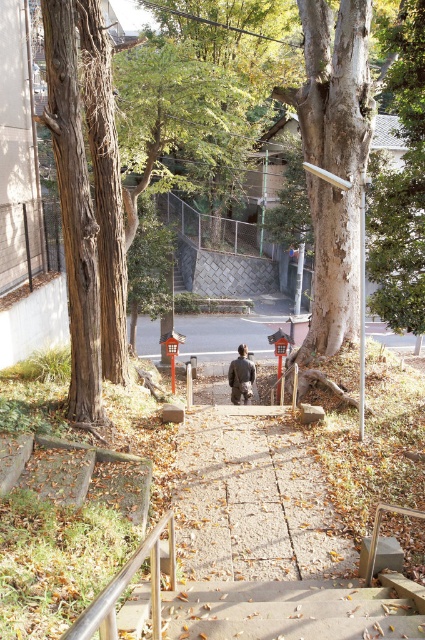
Question: Based on their relative distances, which object is farther from the camouflage jacket at center?

Choices:
 (A) concrete stairs at center
 (B) metallic silver railing at lower left

Answer: (B)

Question: Is metallic silver railing at lower left in front of camouflage jacket at center?

Choices:
 (A) no
 (B) yes

Answer: (B)

Question: Considering the relative positions of metallic silver railing at lower left and camouflage jacket at center in the image provided, where is metallic silver railing at lower left located with respect to camouflage jacket at center?

Choices:
 (A) left
 (B) right

Answer: (A)

Question: Which of these objects is positioned closest to the concrete stairs at center?

Choices:
 (A) metallic silver railing at lower left
 (B) camouflage jacket at center

Answer: (A)

Question: Which of these objects is positioned closest to the camouflage jacket at center?

Choices:
 (A) metallic silver railing at lower left
 (B) concrete stairs at center

Answer: (B)

Question: Can you confirm if concrete stairs at center is positioned to the right of camouflage jacket at center?

Choices:
 (A) yes
 (B) no

Answer: (A)